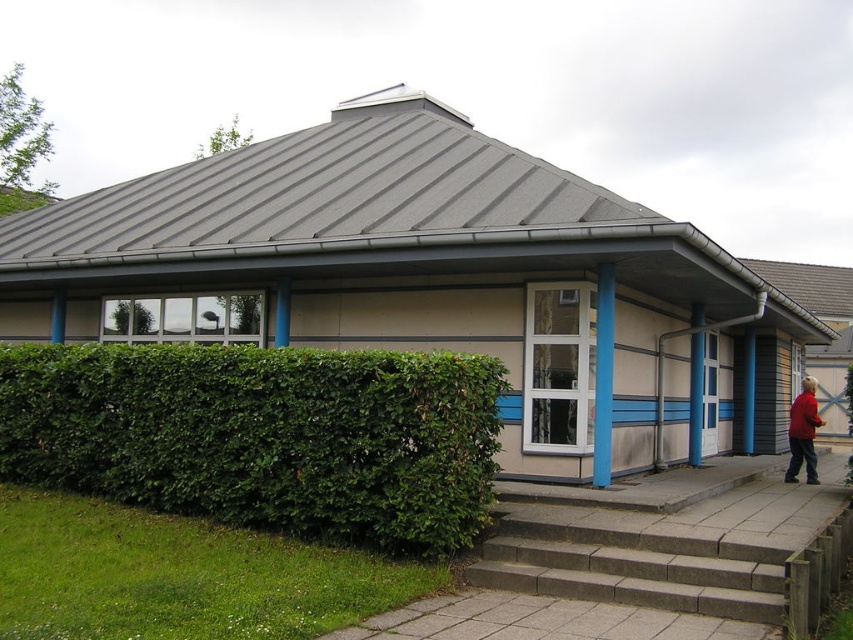
Consider the image. You are standing in front of the building and want to enter. Which object is closer to you, the green leafy hedge at lower left or the gray concrete stairs at lower center?

The green leafy hedge at lower left is closer to you than the gray concrete stairs at lower center.

You are standing at the entrance of the building and want to move towards the point at coordinates point (200, 458). Which direction should you walk relative to the point at coordinates point (689, 552)?

Since point (200, 458) is behind point (689, 552), you should walk in the direction away from point (689, 552) to reach point (200, 458).

You are a delivery person carrying a package weighing 20 kilograms. You need to reach the entrance of the building shown in the image. The entrance is located near the gray concrete stairs at lower center. There is a green leafy hedge at lower left blocking your path. Can you walk around the hedge to reach the stairs without going through the hedge?

The distance between the green leafy hedge at lower left and gray concrete stairs at lower center is 2.25 meters. Since the hedge is not directly in front of the stairs and there is space between them, you can walk around the hedge to reach the stairs without going through it.